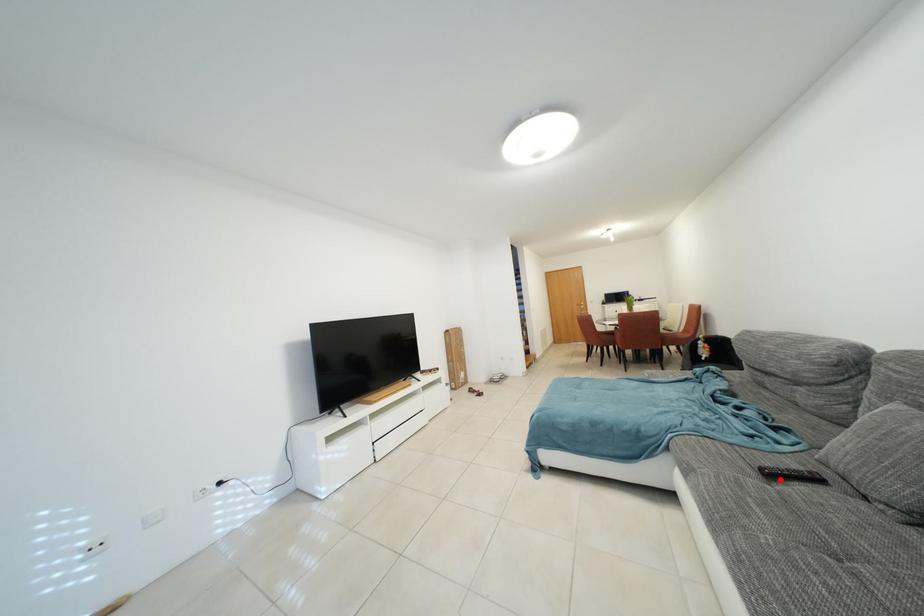
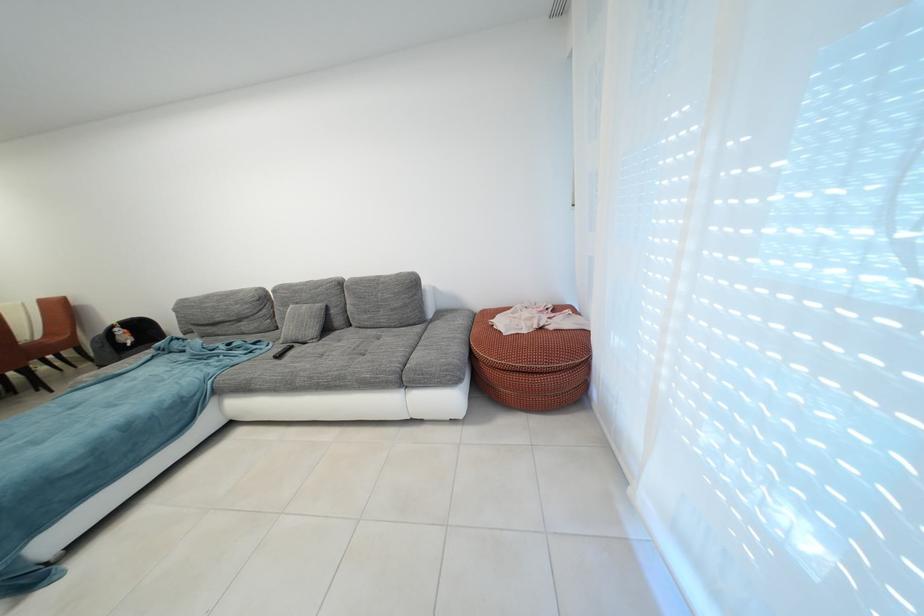
In the second image, find the point that corresponds to the highlighted location in the first image.

(287, 361)